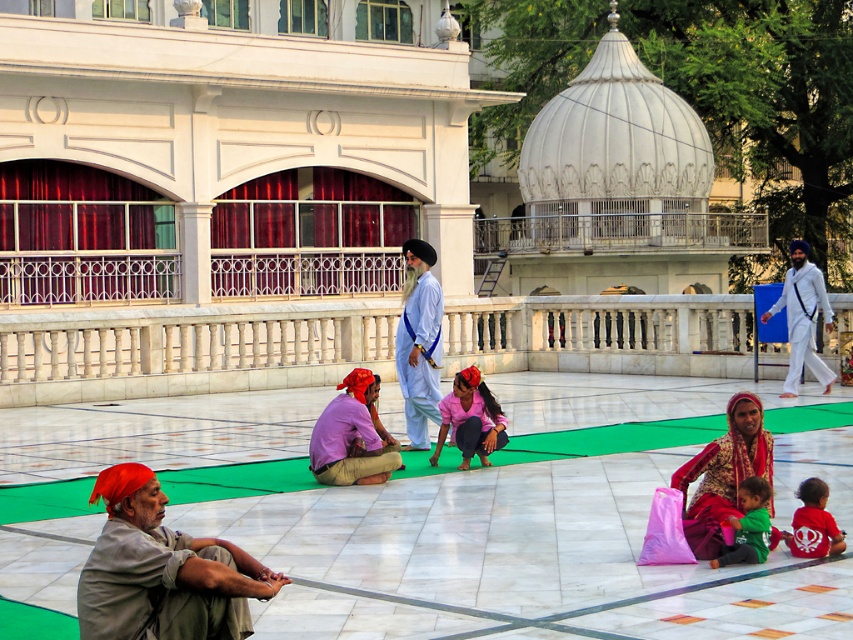
Question: Is embroidered silk sari at lower right closer to camera compared to pink matte/soft fabric at center?

Choices:
 (A) yes
 (B) no

Answer: (A)

Question: Which point is closer to the camera?

Choices:
 (A) (798, 268)
 (B) (473, 406)
 (C) (323, 433)

Answer: (C)

Question: Which of these objects is positioned closest to the light blue cotton kurta at center?

Choices:
 (A) pink matte/soft fabric at center
 (B) white cotton turban at right

Answer: (A)

Question: Can you confirm if gray fabric turban at lower left is positioned to the left of light blue cotton kurta at center?

Choices:
 (A) no
 (B) yes

Answer: (B)

Question: Can you confirm if light blue cotton kurta at center is positioned below pink cotton shirt at center?

Choices:
 (A) yes
 (B) no

Answer: (B)

Question: Which object appears closest to the camera in this image?

Choices:
 (A) white cotton turban at right
 (B) pink cotton shirt at center
 (C) gray fabric turban at lower left

Answer: (C)